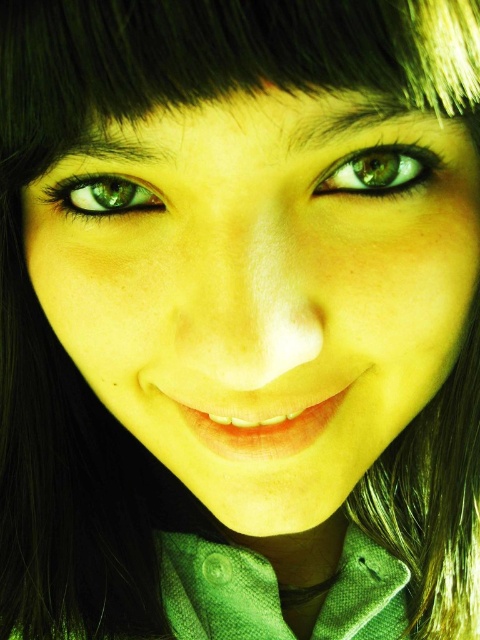
Question: Based on their relative distances, which object is nearer to the green matte face at center?

Choices:
 (A) green matte eye at upper left
 (B) green matte eye at upper center

Answer: (B)

Question: Does green textured dress shirt at center appear under green matte eye at upper center?

Choices:
 (A) no
 (B) yes

Answer: (B)

Question: Considering the real-world distances, which object is closest to the green textured dress shirt at center?

Choices:
 (A) green matte eye at upper center
 (B) green matte face at center

Answer: (B)

Question: Does green matte eye at upper center appear on the right side of green matte eye at upper left?

Choices:
 (A) yes
 (B) no

Answer: (A)

Question: Among these objects, which one is nearest to the camera?

Choices:
 (A) green matte face at center
 (B) green textured dress shirt at center
 (C) green matte eye at upper center
 (D) green matte eye at upper left

Answer: (A)

Question: Does green matte eye at upper center appear on the left side of green matte eye at upper left?

Choices:
 (A) yes
 (B) no

Answer: (B)